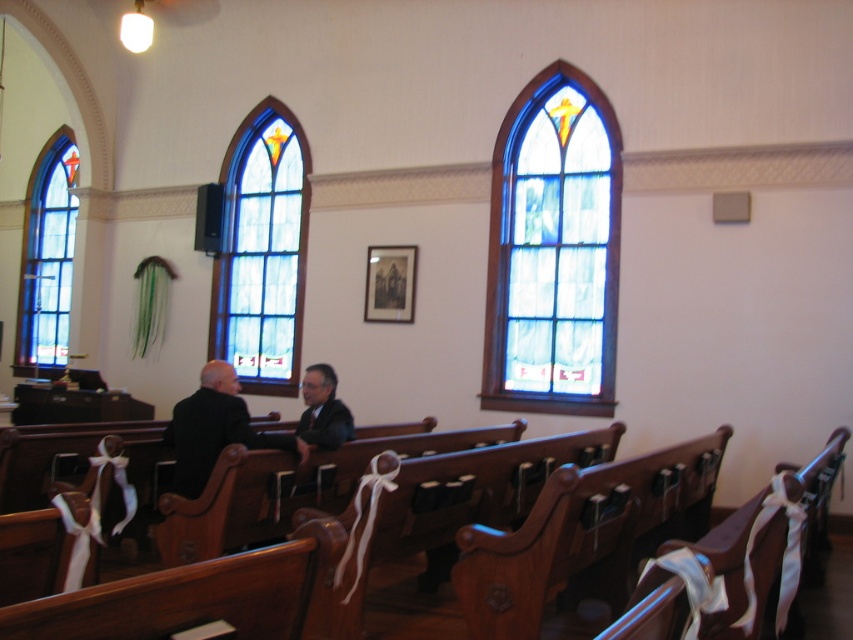
Question: Can you confirm if stained glass at right is positioned to the left of blue stained glass window at center?

Choices:
 (A) no
 (B) yes

Answer: (A)

Question: Among these points, which one is nearest to the camera?

Choices:
 (A) (537, 259)
 (B) (53, 186)

Answer: (A)

Question: Which point is farther from the camera taking this photo?

Choices:
 (A) (42, 195)
 (B) (296, 355)

Answer: (A)

Question: Does blue stained glass window at center have a greater width compared to blue stained glass window at left?

Choices:
 (A) yes
 (B) no

Answer: (A)

Question: Which object is farther from the camera taking this photo?

Choices:
 (A) blue stained glass window at left
 (B) stained glass at right

Answer: (A)

Question: From the image, what is the correct spatial relationship of blue stained glass window at center in relation to blue stained glass window at left?

Choices:
 (A) right
 (B) left

Answer: (A)